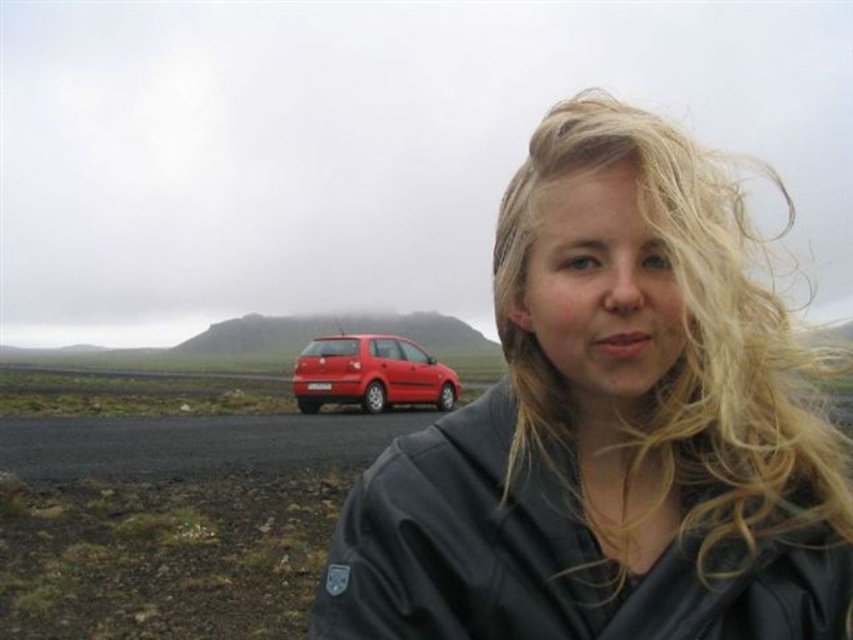
Does blonde silky hair at center have a lesser height compared to shiny red hatchback at center?

No.

Does blonde silky hair at center have a lesser width compared to shiny red hatchback at center?

Incorrect, blonde silky hair at center's width is not less than shiny red hatchback at center's.

Who is more distant from viewer, [576,128] or [338,336]?

Point [338,336]

Where is `blonde silky hair at center`? This screenshot has height=640, width=853. blonde silky hair at center is located at coordinates (663, 352).